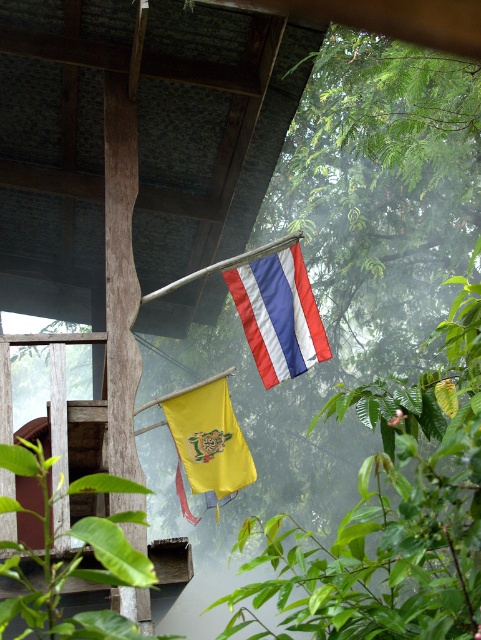
Does silky fabric flag at center have a lesser height compared to yellow matte flag at upper center?

No.

Is silky fabric flag at center positioned behind yellow matte flag at upper center?

No.

Between point (268, 289) and point (254, 470), which one is positioned in front?

Point (268, 289)

What are the coordinates of `silky fabric flag at center` in the screenshot? It's located at (278, 314).